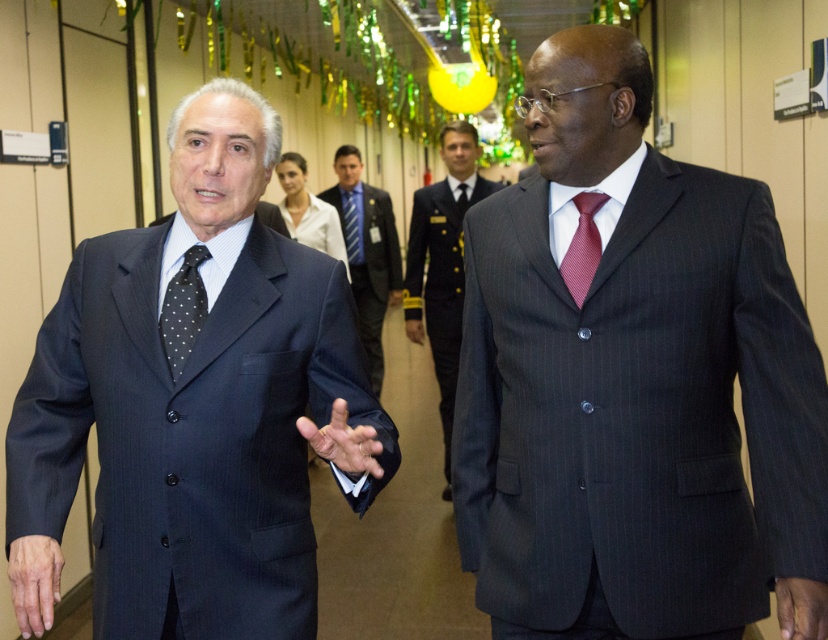
Question: Which object appears farthest from the camera in this image?

Choices:
 (A) matte black suit at left
 (B) blue striped tie at center
 (C) dark gray suit at center
 (D) dark pinstripe suit at center

Answer: (B)

Question: Does dark gray suit at center have a lesser width compared to dark blue silk tie at center?

Choices:
 (A) yes
 (B) no

Answer: (B)

Question: Does dark gray pinstripe suit at center have a larger size compared to red textured tie at center?

Choices:
 (A) no
 (B) yes

Answer: (B)

Question: Which of the following is the closest to the observer?

Choices:
 (A) blue striped tie at center
 (B) black dotted tie at left
 (C) dark gray pinstripe suit at center

Answer: (B)

Question: Considering the real-world distances, which object is closest to the dark gray pinstripe suit at center?

Choices:
 (A) dark gray suit at center
 (B) blue striped tie at center
 (C) red textured tie at center
 (D) dark blue silk tie at center

Answer: (D)

Question: From the image, what is the correct spatial relationship of matte black suit at left in relation to red textured tie at center?

Choices:
 (A) right
 (B) left

Answer: (B)